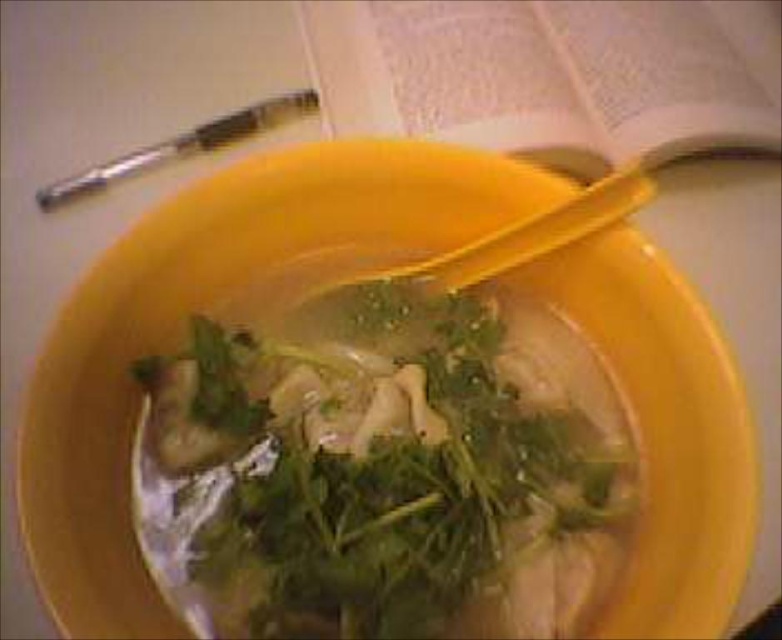
Question: Which of these objects is positioned farthest from the metallic pen at upper left?

Choices:
 (A) white paper book at upper center
 (B) green leafy vegetable at center

Answer: (B)

Question: Which point appears farthest from the camera in this image?

Choices:
 (A) (318, 99)
 (B) (149, 442)

Answer: (A)

Question: Among these points, which one is farthest from the camera?

Choices:
 (A) (291, 100)
 (B) (335, 600)
 (C) (361, 33)

Answer: (C)

Question: Can you confirm if white paper book at upper center is smaller than metallic pen at upper left?

Choices:
 (A) no
 (B) yes

Answer: (A)

Question: Can you confirm if green leafy vegetable at center is bigger than metallic pen at upper left?

Choices:
 (A) no
 (B) yes

Answer: (B)

Question: Is green leafy vegetable at center bigger than metallic pen at upper left?

Choices:
 (A) no
 (B) yes

Answer: (B)